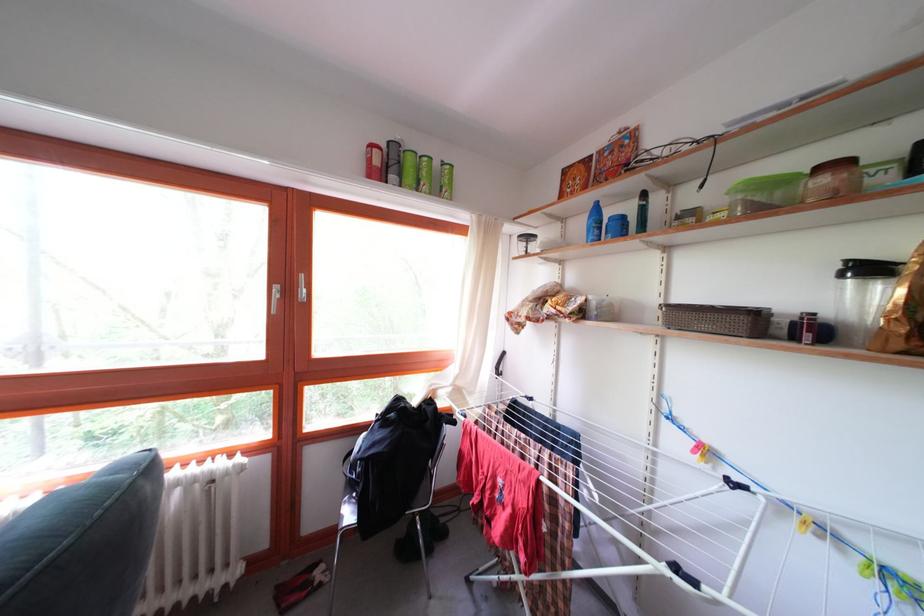
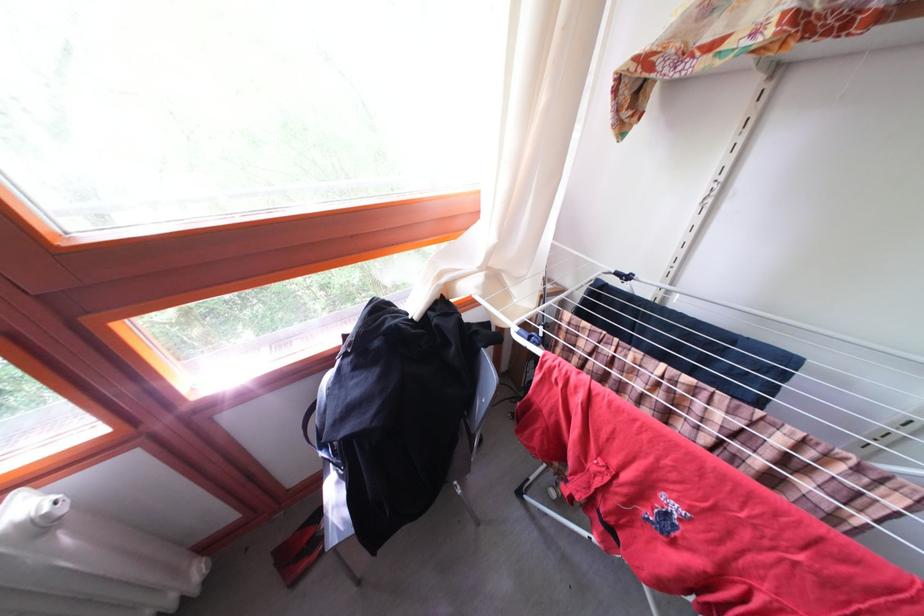
Question: The first image is from the beginning of the video and the second image is from the end. How did the camera likely rotate when shooting the video?

Choices:
 (A) Left
 (B) Right
 (C) Up
 (D) Down

Answer: (D)